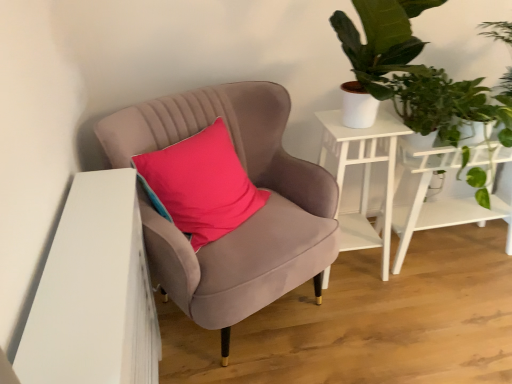
Question: Does white wood side table at upper right, arranged as the 1th table when viewed from the left, have a larger size compared to velvet pink pillow at center?

Choices:
 (A) no
 (B) yes

Answer: (B)

Question: From the image's perspective, would you say white wood side table at upper right, arranged as the 1th table when viewed from the left, is shown under velvet pink pillow at center?

Choices:
 (A) no
 (B) yes

Answer: (B)

Question: Is white wood side table at upper right, arranged as the 1th table when viewed from the left, located outside velvet pink pillow at center?

Choices:
 (A) yes
 (B) no

Answer: (A)

Question: Is white wood side table at upper right, the second table viewed from the right, positioned before velvet pink pillow at center?

Choices:
 (A) yes
 (B) no

Answer: (B)

Question: From the image's perspective, is white wood side table at upper right, arranged as the 1th table when viewed from the left, over velvet pink pillow at center?

Choices:
 (A) yes
 (B) no

Answer: (B)

Question: Is velvet pink pillow at center at the back of white wood side table at upper right, the second table viewed from the right?

Choices:
 (A) no
 (B) yes

Answer: (A)

Question: Is green leafy plant at upper right beside velvet pink pillow at center?

Choices:
 (A) no
 (B) yes

Answer: (A)

Question: Does green leafy plant at upper right have a lesser height compared to velvet pink pillow at center?

Choices:
 (A) no
 (B) yes

Answer: (B)

Question: Considering the relative sizes of green leafy plant at upper right and velvet pink pillow at center in the image provided, is green leafy plant at upper right bigger than velvet pink pillow at center?

Choices:
 (A) yes
 (B) no

Answer: (A)

Question: From the image's perspective, is green leafy plant at upper right below velvet pink pillow at center?

Choices:
 (A) yes
 (B) no

Answer: (B)

Question: Does green leafy plant at upper right have a lesser width compared to velvet pink pillow at center?

Choices:
 (A) no
 (B) yes

Answer: (A)

Question: Can you confirm if green leafy plant at upper right is smaller than velvet pink pillow at center?

Choices:
 (A) no
 (B) yes

Answer: (A)

Question: Considering the relative positions of white wood side table at upper right, the second table viewed from the right, and green leafy plant at upper right in the image provided, is white wood side table at upper right, the second table viewed from the right, to the left of green leafy plant at upper right from the viewer's perspective?

Choices:
 (A) no
 (B) yes

Answer: (B)